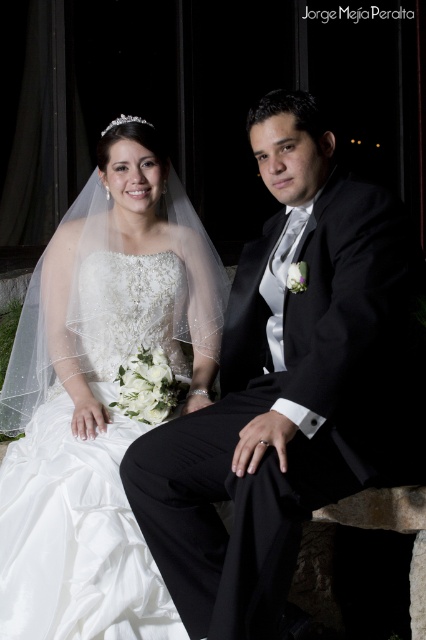
You are a photographer at the wedding. You want to capture a photo where both the black satin suit at center and the white satin dress at center are visible. Considering their heights, which one might appear shorter in the photo?

The black satin suit at center appears shorter than the white satin dress at center in the photo.